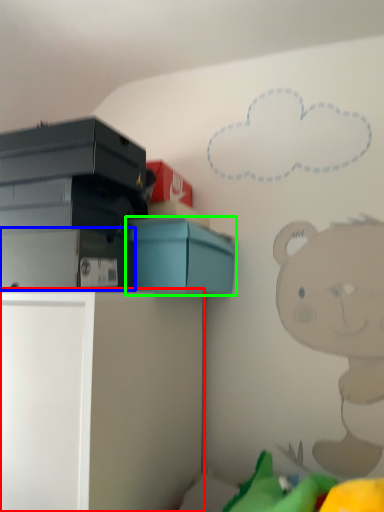
Question: Considering the real-world distances, which object is closest to furniture (highlighted by a red box)? storage box (highlighted by a blue box) or box (highlighted by a green box).

Choices:
 (A) storage box
 (B) box

Answer: (A)